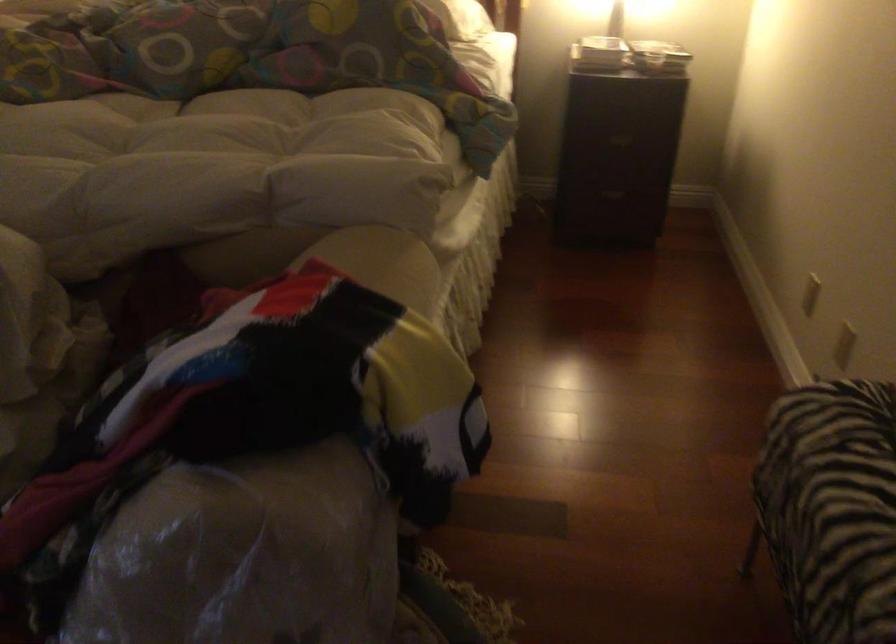
Describe the element at coordinates (831, 507) in the screenshot. I see `the chair sitting surface` at that location.